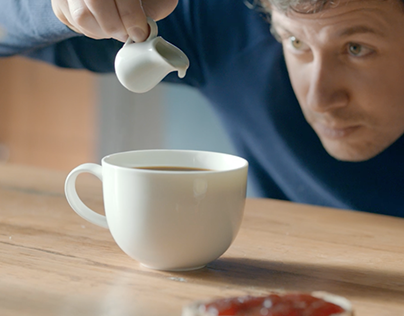
Find the location of a particular element. The image size is (404, 316). handle on white teacup is located at coordinates (83, 170).